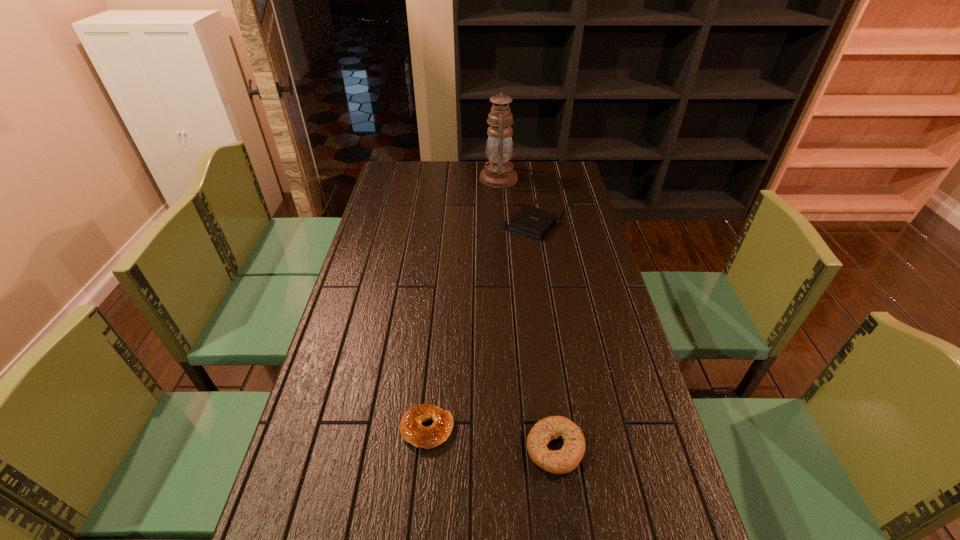
Where is `free space between the shorter bagel and the second farthest object`? free space between the shorter bagel and the second farthest object is located at coordinates (x=481, y=327).

Image resolution: width=960 pixels, height=540 pixels. I want to click on free space between the leftmost object and the right bagel, so click(x=492, y=438).

Where is `free space between the router and the right bagel`? The width and height of the screenshot is (960, 540). free space between the router and the right bagel is located at coordinates (545, 337).

In order to click on free space that is in between the router and the left bagel in this screenshot , I will do `click(481, 327)`.

Find the location of `empty space that is in between the farthest object and the right bagel`. empty space that is in between the farthest object and the right bagel is located at coordinates (527, 313).

Where is `empty location between the farthest object and the right bagel`? empty location between the farthest object and the right bagel is located at coordinates (527, 313).

Image resolution: width=960 pixels, height=540 pixels. What are the coordinates of `free point between the farthest object and the second tallest object` in the screenshot? It's located at (516, 202).

Choose which object is the nearest neighbor to the shortest object. Please provide its 2D coordinates. Your answer should be formatted as a tuple, i.e. [(x, y)], where the tuple contains the x and y coordinates of a point satisfying the conditions above.

[(562, 461)]

Identify which object is located as the second nearest to the farthest object. Please provide its 2D coordinates. Your answer should be formatted as a tuple, i.e. [(x, y)], where the tuple contains the x and y coordinates of a point satisfying the conditions above.

[(411, 430)]

What are the coordinates of `free point that satisfies the following two spatial constraints: 1. on the back side of the second farthest object; 2. on the left side of the right bagel` in the screenshot? It's located at (526, 226).